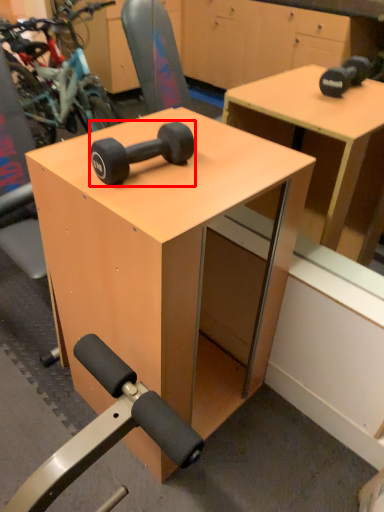
Question: From the image's perspective, where is dumbbell (annotated by the red box) located in relation to table in the image?

Choices:
 (A) below
 (B) above

Answer: (B)